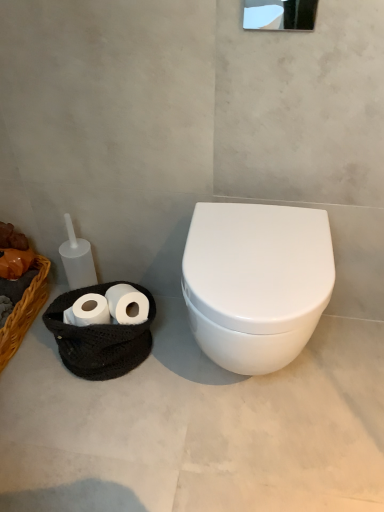
Image resolution: width=384 pixels, height=512 pixels. What are the coordinates of `blank space above white glossy toilet at center (from a real-world perspective)` in the screenshot? It's located at (268, 247).